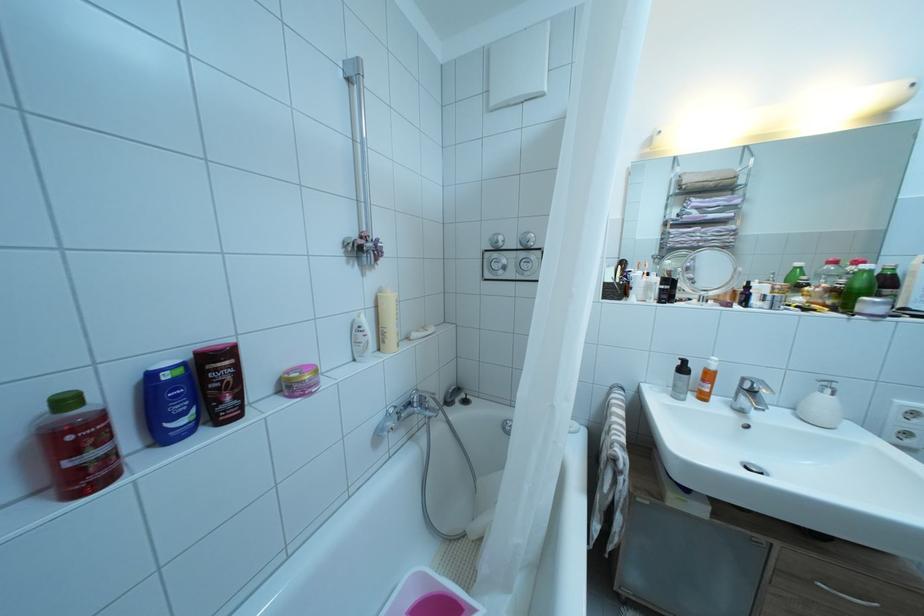
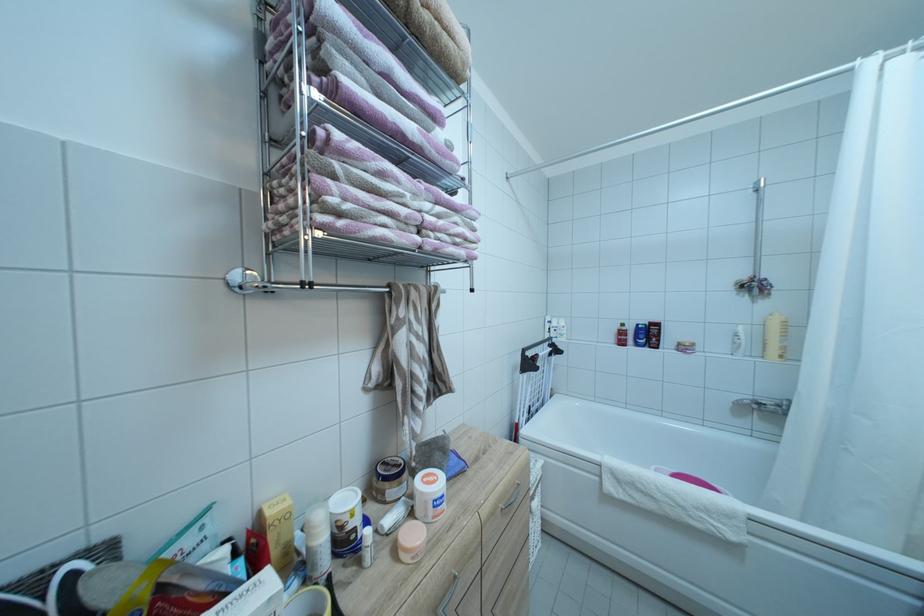
The point at (x=162, y=424) is marked in the first image. Where is the corresponding point in the second image?

(642, 342)